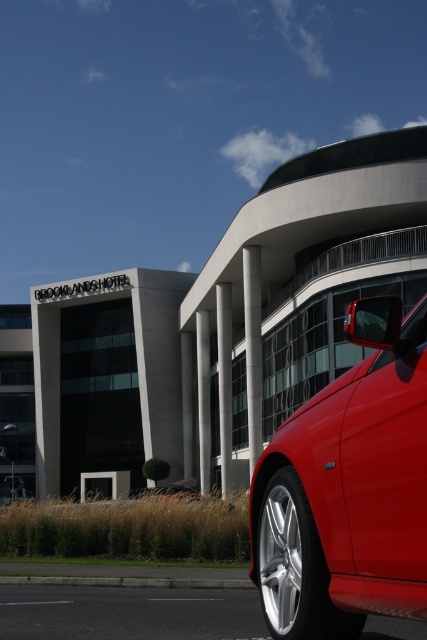
You are a delivery person with a 10 feet wide truck. You need to park your truck between the glossy red car at right and the white smooth pillar at center. Is there enough space for your truck?

The glossy red car at right is 173.13 feet from the white smooth pillar at center. Since your truck is only 10 feet wide, there is more than enough space to park between them.

You are standing in front of the BROOKLANDSHOTEL and want to take a photo of the glossy red car at right. If your camera can focus on objects up to 15 feet away, will you need to move closer or farther away to get a clear shot?

The glossy red car at right is 13.10 feet away from you. Since your camera can focus up to 15 feet, you don not need to move closer or farther away. You can take the photo from your current position.